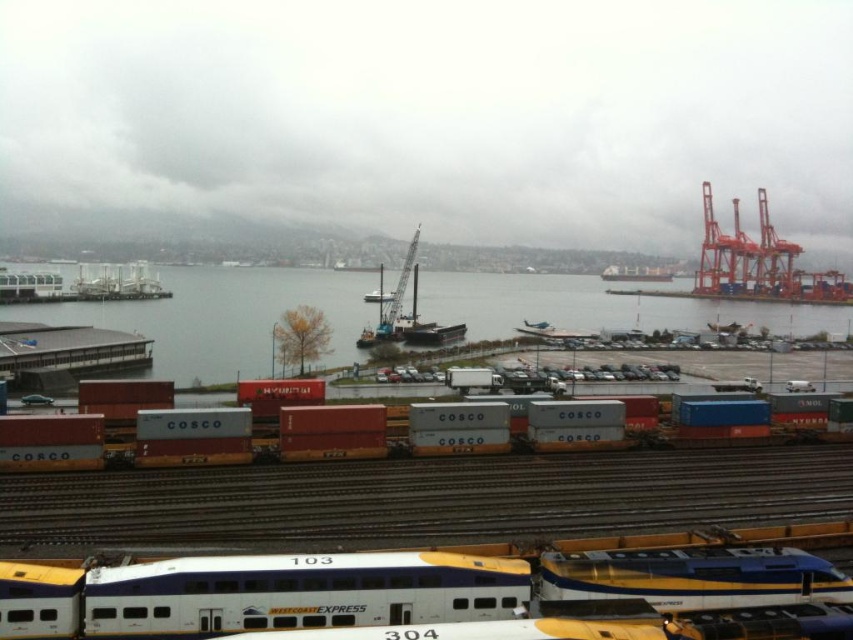
In the scene shown: You are a delivery driver who needs to park your truck in the parking lot. You notice the clear water at lower left and the metallic gray container at center. Which object is larger in size?

The clear water at lower left is bigger than the metallic gray container at center.

You are a crane operator at the port and need to lower a heavy load from the crane. You see the clear water at lower left and the metallic gray container at center. Which object is above the other?

The clear water at lower left is positioned over the metallic gray container at center, so the clear water at lower left is above the metallic gray container at center.